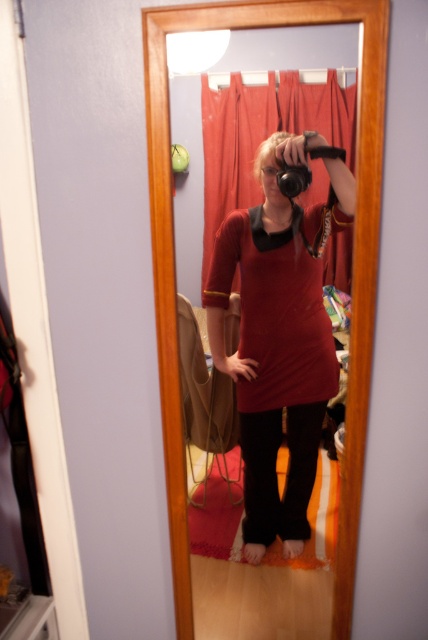
Question: Which point is closer to the camera taking this photo?

Choices:
 (A) (238, 122)
 (B) (252, 410)

Answer: (B)

Question: Is the position of red fabric curtain at center more distant than that of blonde hair at upper center?

Choices:
 (A) yes
 (B) no

Answer: (A)

Question: Which object is the closest to the matte red dress at center?

Choices:
 (A) blonde hair at upper center
 (B) matte wood mirror at center
 (C) red fabric curtain at center

Answer: (B)

Question: Is matte red dress at center below red fabric curtain at center?

Choices:
 (A) yes
 (B) no

Answer: (A)

Question: Which point is closer to the camera?

Choices:
 (A) matte red dress at center
 (B) blonde hair at upper center
 (C) red fabric curtain at center

Answer: (A)

Question: From the image, what is the correct spatial relationship of matte red dress at center in relation to matte wood mirror at center?

Choices:
 (A) right
 (B) left

Answer: (A)